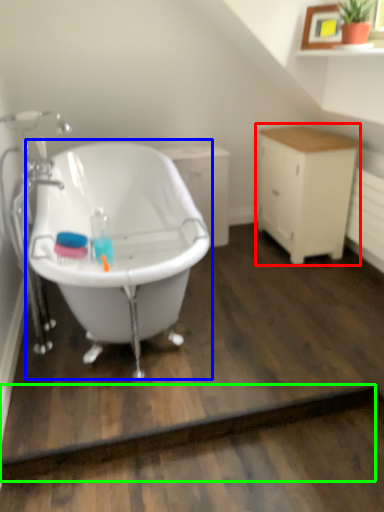
Question: Which object is positioned farthest from cabinetry (highlighted by a red box)? Select from bathtub (highlighted by a blue box) and plank (highlighted by a green box).

Choices:
 (A) bathtub
 (B) plank

Answer: (B)